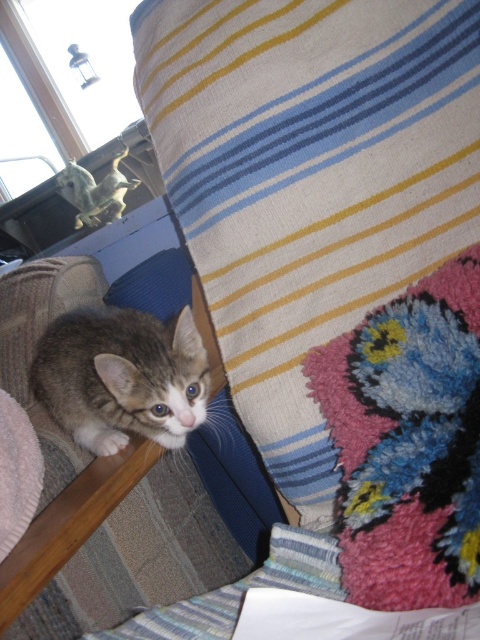
You are navigating a small robot through the scene. The robot must move from the starting point at point (x=343, y=92) to the endpoint at point (x=50, y=394). According to the spatial relationship between these two points, which direction should the robot move to reach the endpoint?

The robot should move backward because point (x=343, y=92) is in front of point (x=50, y=394), meaning the endpoint is behind the starting point.

You are an interior designer looking at this image. You need to place a small decorative item exactly at the location marked by the point (310,182). What object in the scene is located at this point?

The striped woolen blanket at upper right is located at point (310,182).